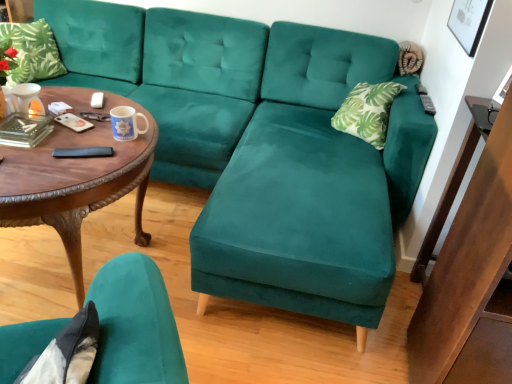
Measure the distance between point (89, 97) and camera.

Point (89, 97) and camera are 5.87 feet apart from each other.

This screenshot has height=384, width=512. What do you see at coordinates (451, 187) in the screenshot? I see `wooden side table at right` at bounding box center [451, 187].

This screenshot has height=384, width=512. What do you see at coordinates (135, 325) in the screenshot? I see `velvet teal chair at lower left` at bounding box center [135, 325].

This screenshot has height=384, width=512. I want to click on woodencoffee table at left, so click(x=75, y=176).

How many degrees apart are the facing directions of velvet teal chair at lower left and woodencoffee table at left?

75.8 degrees separate the facing orientations of velvet teal chair at lower left and woodencoffee table at left.

The width and height of the screenshot is (512, 384). Identify the location of coffee table that appears on the left of velvet teal chair at lower left. (75, 176).

From the image's perspective, would you say velvet teal chair at lower left is positioned over woodencoffee table at left?

No.

Is velvet teal chair at lower left turned away from woodencoffee table at left?

velvet teal chair at lower left does not have its back to woodencoffee table at left.

Find the location of a particular element. The width and height of the screenshot is (512, 384). pillow above the wooden side table at right (from a real-world perspective) is located at coordinates (32, 52).

Considering the sizes of objects wooden side table at right and green leafy fabric pillow at upper left in the image provided, who is shorter, wooden side table at right or green leafy fabric pillow at upper left?

green leafy fabric pillow at upper left is shorter.

From a real-world perspective, who is located higher, wooden side table at right or green leafy fabric pillow at upper left?

green leafy fabric pillow at upper left is physically above.

Considering the relative sizes of wooden side table at right and green leafy fabric pillow at upper left in the image provided, is wooden side table at right bigger than green leafy fabric pillow at upper left?

Indeed, wooden side table at right has a larger size compared to green leafy fabric pillow at upper left.

Does velvet teal chair at lower left have a greater width compared to green leafy fabric pillow at upper left?

Yes, velvet teal chair at lower left is wider than green leafy fabric pillow at upper left.

Considering the positions of point (145, 368) and point (38, 24), is point (145, 368) closer or farther from the camera than point (38, 24)?

Point (145, 368) appears to be closer to the viewer than point (38, 24).

Which object is positioned more to the left, velvet teal chair at lower left or green leafy fabric pillow at upper left?

green leafy fabric pillow at upper left.

In the image, is woodencoffee table at left positioned in front of or behind wooden side table at right?

In the image, woodencoffee table at left appears in front of wooden side table at right.

How many degrees apart are the facing directions of woodencoffee table at left and wooden side table at right?

The facing directions of woodencoffee table at left and wooden side table at right are 92.3 degrees apart.

Can you confirm if woodencoffee table at left is shorter than wooden side table at right?

Yes, woodencoffee table at left is shorter than wooden side table at right.

Is woodencoffee table at left situated inside wooden side table at right or outside?

woodencoffee table at left is outside wooden side table at right.

Which object is thinner, woodencoffee table at left or velvet teal chair at lower left?

velvet teal chair at lower left is thinner.

Between woodencoffee table at left and velvet teal chair at lower left, which one has smaller size?

With smaller size is velvet teal chair at lower left.

Is velvet teal chair at lower left inside woodencoffee table at left?

No, woodencoffee table at left does not contain velvet teal chair at lower left.

From a real-world perspective, is woodencoffee table at left located higher than velvet teal chair at lower left?

No, from a real-world perspective, woodencoffee table at left is not on top of velvet teal chair at lower left.

Considering the relative positions of green leafy fabric pillow at upper left and woodencoffee table at left in the image provided, is green leafy fabric pillow at upper left to the right of woodencoffee table at left from the viewer's perspective?

Incorrect, green leafy fabric pillow at upper left is not on the right side of woodencoffee table at left.

Between green leafy fabric pillow at upper left and woodencoffee table at left, which one has larger size?

woodencoffee table at left is bigger.

Is green leafy fabric pillow at upper left located outside woodencoffee table at left?

Yes, green leafy fabric pillow at upper left is outside of woodencoffee table at left.

What's the angular difference between green leafy fabric pillow at upper left and woodencoffee table at left's facing directions?

green leafy fabric pillow at upper left and woodencoffee table at left are facing 67.8 degrees away from each other.

What are the coordinates of `pillow on the left of the woodencoffee table at left` in the screenshot? It's located at [32, 52].

Considering the sizes of objects woodencoffee table at left and green leafy fabric pillow at upper left in the image provided, who is wider, woodencoffee table at left or green leafy fabric pillow at upper left?

woodencoffee table at left is wider.

Is woodencoffee table at left oriented away from green leafy fabric pillow at upper left?

No, woodencoffee table at left is not facing the opposite direction of green leafy fabric pillow at upper left.

Is woodencoffee table at left placed right next to green leafy fabric pillow at upper left?

No, woodencoffee table at left is not next to green leafy fabric pillow at upper left.

I want to click on coffee table below the velvet teal chair at lower left (from a real-world perspective), so click(x=75, y=176).

The height and width of the screenshot is (384, 512). Identify the location of pillow located behind the wooden side table at right. (32, 52).

Based on their spatial positions, is woodencoffee table at left or green leafy fabric pillow at upper left further from velvet teal chair at lower left?

Among the two, green leafy fabric pillow at upper left is located further to velvet teal chair at lower left.

Estimate the real-world distances between objects in this image. Which object is closer to wooden side table at right, woodencoffee table at left or green leafy fabric pillow at upper left?

Based on the image, woodencoffee table at left appears to be nearer to wooden side table at right.

From the image, which object appears to be farther from woodencoffee table at left, velvet teal chair at lower left or green leafy fabric pillow at upper left?

Based on the image, green leafy fabric pillow at upper left appears to be further to woodencoffee table at left.

From the image, which object appears to be nearer to wooden side table at right, velvet teal chair at lower left or green leafy fabric pillow at upper left?

velvet teal chair at lower left is positioned closer to the anchor wooden side table at right.

Which object lies further to the anchor point woodencoffee table at left, wooden side table at right or green leafy fabric pillow at upper left?

wooden side table at right is further to woodencoffee table at left.

Considering their positions, is green leafy fabric pillow at upper left positioned further to velvet teal chair at lower left than woodencoffee table at left?

green leafy fabric pillow at upper left is further to velvet teal chair at lower left.

When comparing their distances from woodencoffee table at left, does green leafy fabric pillow at upper left or wooden side table at right seem further?

wooden side table at right.

Estimate the real-world distances between objects in this image. Which object is further from green leafy fabric pillow at upper left, velvet teal chair at lower left or woodencoffee table at left?

Among the two, velvet teal chair at lower left is located further to green leafy fabric pillow at upper left.

Identify the location of coffee table between velvet teal chair at lower left and green leafy fabric pillow at upper left along the z-axis. Image resolution: width=512 pixels, height=384 pixels. (75, 176).

The width and height of the screenshot is (512, 384). Identify the location of coffee table between green leafy fabric pillow at upper left and wooden side table at right from left to right. (75, 176).

The width and height of the screenshot is (512, 384). I want to click on chair located between green leafy fabric pillow at upper left and wooden side table at right in the left-right direction, so click(135, 325).

You are a GUI agent. You are given a task and a screenshot of the screen. Output one action in this format:
    pyautogui.click(x=<x>, y=<y>)
    Task: Click on the chair between woodencoffee table at left and wooden side table at right from left to right
    This screenshot has width=512, height=384.
    Given the screenshot: What is the action you would take?
    pyautogui.click(x=135, y=325)